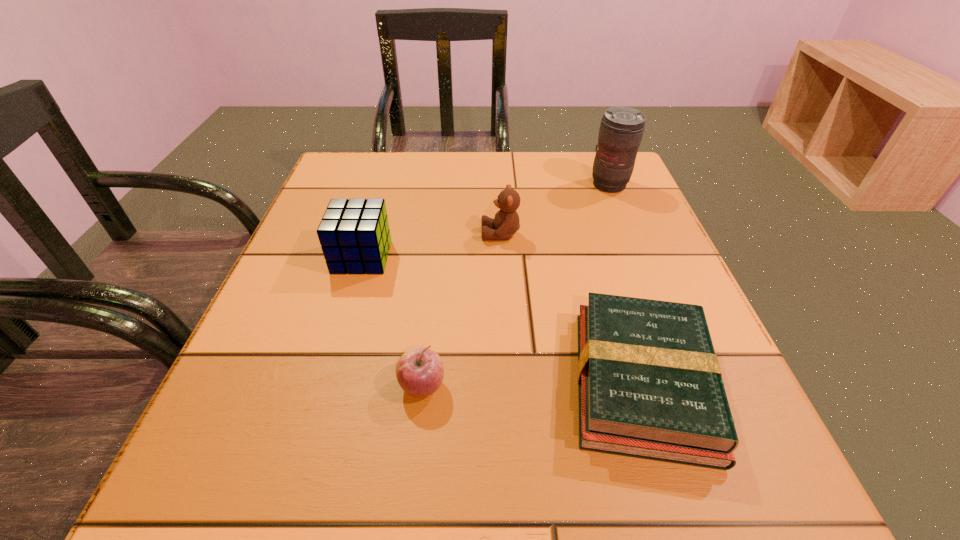
What are the coordinates of `blank area located on the face of the third object from left to right` in the screenshot? It's located at coord(349,234).

Find the location of `vacant space located 0.120m on the front of the cube`. vacant space located 0.120m on the front of the cube is located at coordinates (342, 323).

At what (x,y) coordinates should I click in order to perform the action: click on vacant area situated on the front of the fourth object from right to left. Please return your answer as a coordinate pair (x, y). Image resolution: width=960 pixels, height=540 pixels. Looking at the image, I should click on (417, 440).

Where is `free spot located on the back of the shortest object`? free spot located on the back of the shortest object is located at coordinates (584, 196).

At what (x,y) coordinates should I click in order to perform the action: click on object located in the far edge section of the desktop. Please return your answer as a coordinate pair (x, y). This screenshot has width=960, height=540. Looking at the image, I should click on (621, 130).

Locate an element on the screen. The height and width of the screenshot is (540, 960). object present at the near edge is located at coordinates (650, 386).

You are a GUI agent. You are given a task and a screenshot of the screen. Output one action in this format:
    pyautogui.click(x=<x>, y=<y>)
    Task: Click on the object at the left edge
    Image resolution: width=960 pixels, height=540 pixels.
    Given the screenshot: What is the action you would take?
    pyautogui.click(x=354, y=234)

Locate an element on the screen. telephoto lens positioned at the right edge is located at coordinates (621, 130).

In order to click on hardback book located in the right edge section of the desktop in this screenshot , I will do `click(650, 386)`.

The width and height of the screenshot is (960, 540). I want to click on object that is at the far right corner, so click(x=621, y=130).